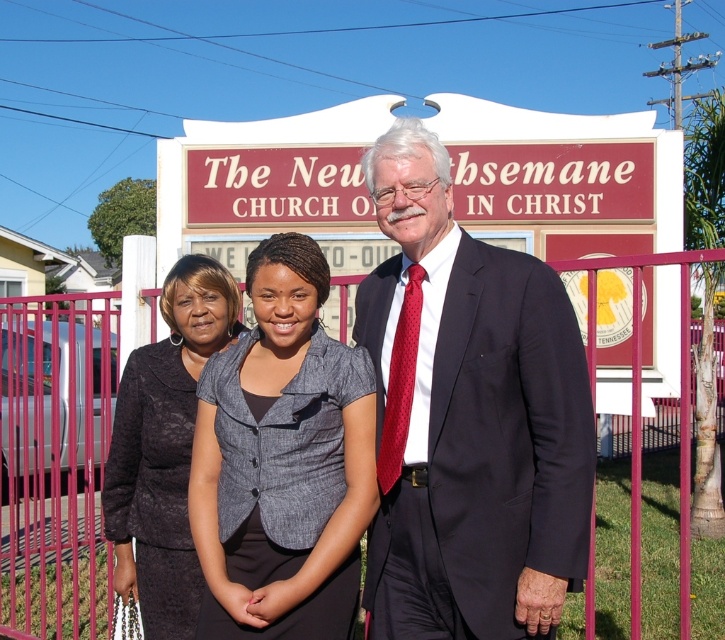
Question: Which point appears farthest from the camera in this image?

Choices:
 (A) (265, 342)
 (B) (522, 256)

Answer: (A)

Question: Can you confirm if navy blue suit at center is positioned above dark gray textured blazer at center?

Choices:
 (A) yes
 (B) no

Answer: (A)

Question: Which object appears farthest from the camera in this image?

Choices:
 (A) gray textured blazer at center
 (B) dark gray textured blazer at center

Answer: (B)

Question: Observing the image, what is the correct spatial positioning of navy blue suit at center in reference to dark gray textured blazer at center?

Choices:
 (A) right
 (B) left

Answer: (A)

Question: Which point is farther to the camera?

Choices:
 (A) (297, 611)
 (B) (207, 339)
 (C) (442, 182)

Answer: (B)

Question: Can you confirm if navy blue suit at center is smaller than gray textured blazer at center?

Choices:
 (A) no
 (B) yes

Answer: (A)